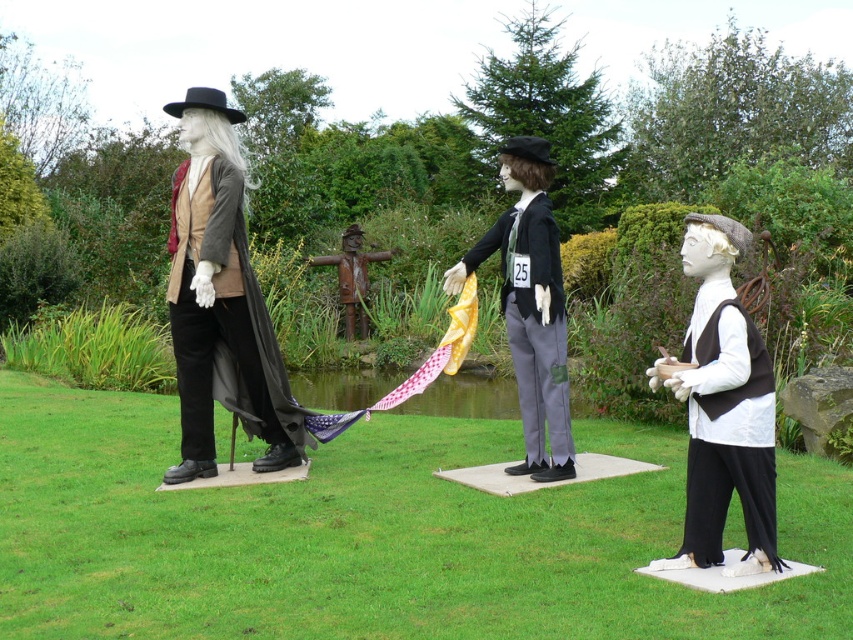
You are standing in the garden and see the mannequin on the right holding a small bowl. There is a point marked at coordinates point (x=722, y=406). What object does this point correspond to?

The point (x=722, y=406) corresponds to the matte black vest at right.

Consider the image. You are standing in the garden and want to touch the matte black vest at right and the rusty metal scarecrow at center. Which one do you need to reach out further to touch?

You need to reach out further to touch the rusty metal scarecrow at center because the matte black vest at right is closer to the viewer than the rusty metal scarecrow at center.